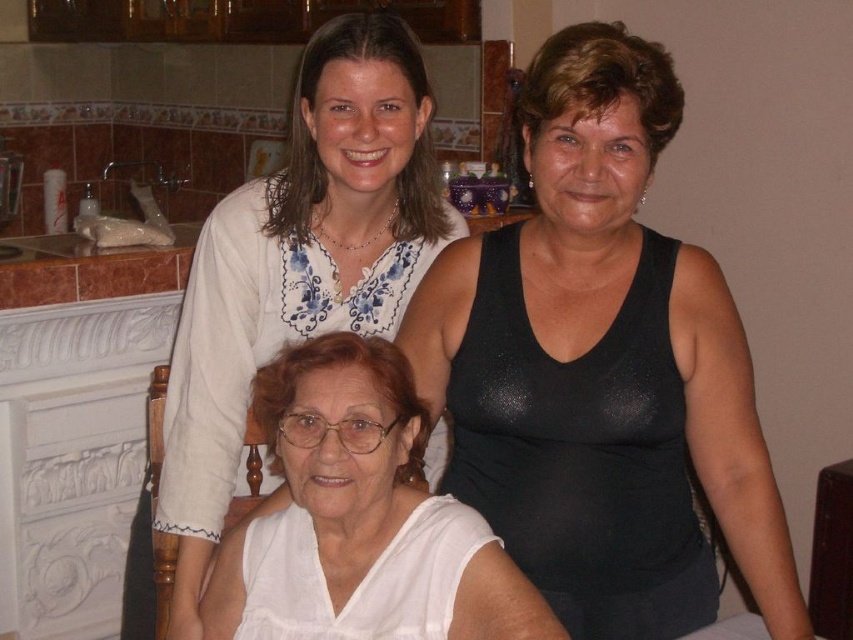
You are organizing a clothing donation drive and need to sort items by size. You have a black shiny tank top at upper right and a white fabric at center. Which item should you place in the large size bin?

The white fabric at center should be placed in the large size bin because it is larger than the black shiny tank top at upper right.